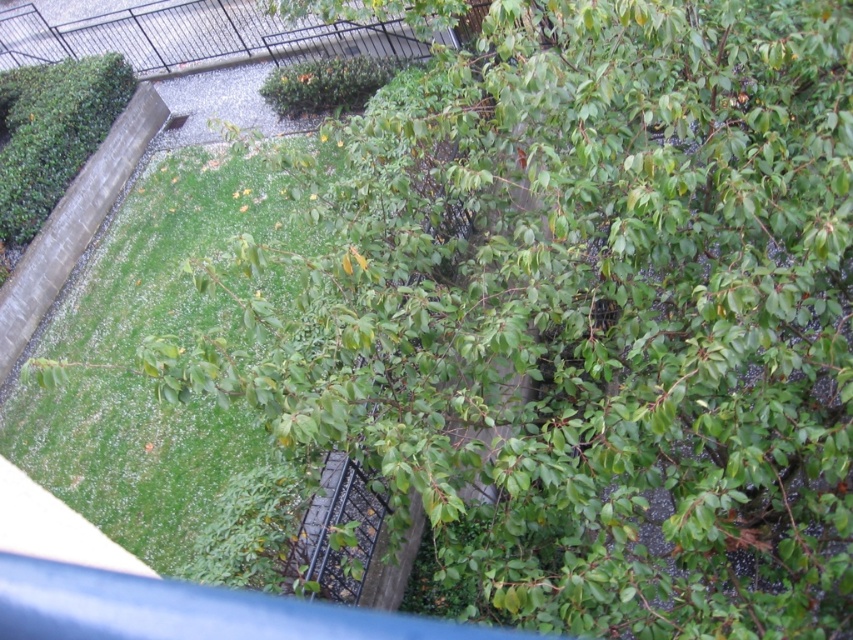
You are standing on a balcony looking down at the garden. You see the green leafy bush at upper left. Can you determine if the bush is closer to the concrete wall or the lawn?

The green leafy bush at upper left is located at point (51, 132). Since the coordinates place it closer to the upper left corner, it is nearer to the concrete wall than the lawn.